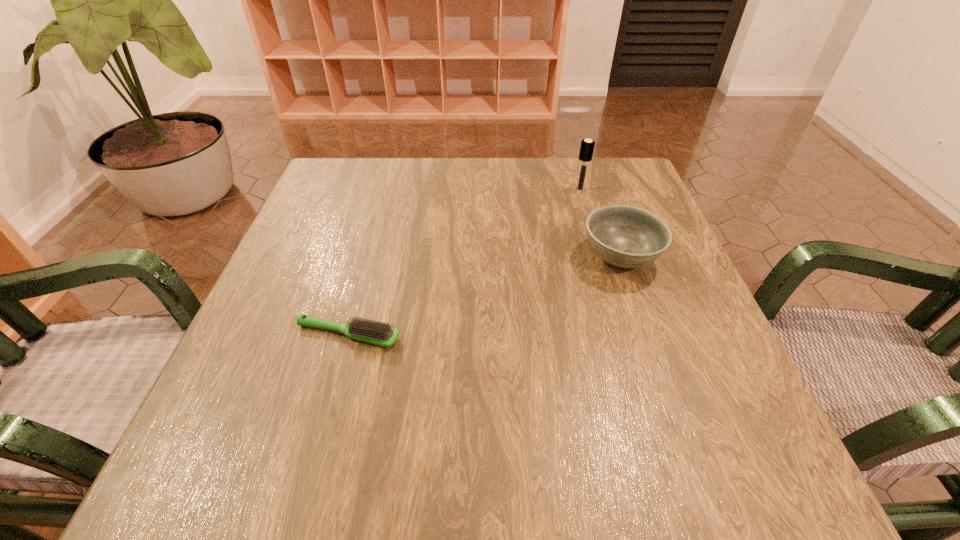
I want to click on free location that satisfies the following two spatial constraints: 1. on the back side of the left hairbrush; 2. on the right side of the farthest object, so click(x=388, y=188).